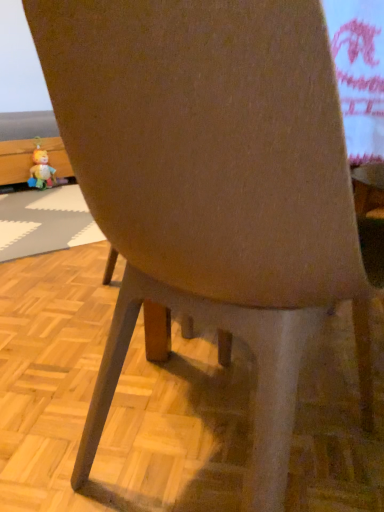
Measure the distance between point (45, 175) and camera.

They are 8.96 feet apart.

Find the location of `plush yellow toy at left`. plush yellow toy at left is located at coordinates (41, 170).

Based on the photo, measure the distance between plush yellow toy at left and camera.

plush yellow toy at left is 2.69 meters away from camera.

The image size is (384, 512). What do you see at coordinates (41, 170) in the screenshot?
I see `plush yellow toy at left` at bounding box center [41, 170].

Find the location of a particular element. white rubber place mat at lower left is located at coordinates (44, 222).

The height and width of the screenshot is (512, 384). Describe the element at coordinates (44, 222) in the screenshot. I see `white rubber place mat at lower left` at that location.

Identify the location of plush yellow toy at left. (41, 170).

Considering the relative positions of plush yellow toy at left and white rubber place mat at lower left in the image provided, is plush yellow toy at left to the right of white rubber place mat at lower left from the viewer's perspective?

No, plush yellow toy at left is not to the right of white rubber place mat at lower left.

Which is behind, plush yellow toy at left or white rubber place mat at lower left?

plush yellow toy at left is further away from the camera.

Is point (45, 167) closer to viewer compared to point (16, 192)?

Yes, point (45, 167) is closer to viewer.

From the image's perspective, is plush yellow toy at left positioned above or below white rubber place mat at lower left?

Based on their image positions, plush yellow toy at left is located above white rubber place mat at lower left.

From a real-world perspective, is plush yellow toy at left beneath white rubber place mat at lower left?

No.

Which of these two, plush yellow toy at left or white rubber place mat at lower left, is thinner?

plush yellow toy at left is thinner.

Who is taller, plush yellow toy at left or white rubber place mat at lower left?

With more height is plush yellow toy at left.

Which of these two, plush yellow toy at left or white rubber place mat at lower left, is smaller?

plush yellow toy at left is smaller.

Is plush yellow toy at left outside of white rubber place mat at lower left?

Indeed, plush yellow toy at left is completely outside white rubber place mat at lower left.

Is plush yellow toy at left far away from white rubber place mat at lower left?

No, there isn't a large distance between plush yellow toy at left and white rubber place mat at lower left.

Is plush yellow toy at left positioned with its back to white rubber place mat at lower left?

No, white rubber place mat at lower left is not at the back of plush yellow toy at left.

How distant is plush yellow toy at left from white rubber place mat at lower left?

plush yellow toy at left and white rubber place mat at lower left are 18.56 inches apart from each other.

Locate an element on the screen. Image resolution: width=384 pixels, height=512 pixels. place mat that appears below the plush yellow toy at left (from a real-world perspective) is located at coordinates (44, 222).

Is white rubber place mat at lower left at the left side of plush yellow toy at left?

No.

Is white rubber place mat at lower left further to the viewer compared to plush yellow toy at left?

No.

Considering the positions of point (89, 234) and point (41, 181), is point (89, 234) closer or farther from the camera than point (41, 181)?

Point (89, 234) is positioned closer to the camera compared to point (41, 181).

From the image's perspective, which one is positioned lower, white rubber place mat at lower left or plush yellow toy at left?

white rubber place mat at lower left, from the image's perspective.

From a real-world perspective, is white rubber place mat at lower left physically located above or below plush yellow toy at left?

In terms of real-world spatial position, white rubber place mat at lower left is below plush yellow toy at left.

Looking at their sizes, would you say white rubber place mat at lower left is wider or thinner than plush yellow toy at left?

In the image, white rubber place mat at lower left appears to be wider than plush yellow toy at left.

Does white rubber place mat at lower left have a lesser height compared to plush yellow toy at left?

Yes, white rubber place mat at lower left is shorter than plush yellow toy at left.

Considering the sizes of white rubber place mat at lower left and plush yellow toy at left in the image, is white rubber place mat at lower left bigger or smaller than plush yellow toy at left?

In the image, white rubber place mat at lower left appears to be larger than plush yellow toy at left.

Is white rubber place mat at lower left not inside plush yellow toy at left?

white rubber place mat at lower left lies outside plush yellow toy at left's area.

Is white rubber place mat at lower left not near plush yellow toy at left?

No, white rubber place mat at lower left is in close proximity to plush yellow toy at left.

Could you tell me if white rubber place mat at lower left is facing plush yellow toy at left?

No, white rubber place mat at lower left is not turned towards plush yellow toy at left.

In order to click on place mat below the plush yellow toy at left (from a real-world perspective) in this screenshot , I will do `click(44, 222)`.

I want to click on toy above the white rubber place mat at lower left (from a real-world perspective), so click(41, 170).

This screenshot has height=512, width=384. I want to click on place mat in front of the plush yellow toy at left, so click(x=44, y=222).